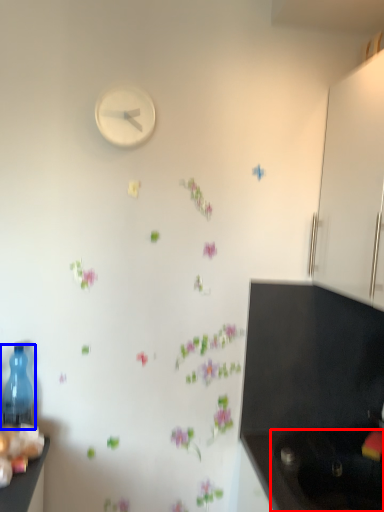
Question: Which point is closer to the camera, sink (highlighted by a red box) or bottle (highlighted by a blue box)?

Choices:
 (A) sink
 (B) bottle

Answer: (A)